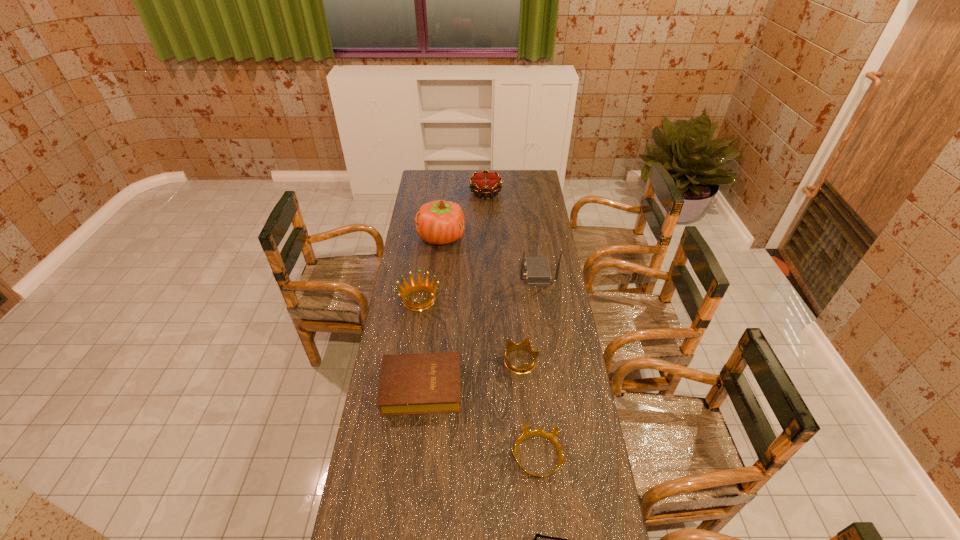
Image resolution: width=960 pixels, height=540 pixels. In order to click on the second farthest object in this screenshot , I will do `click(439, 222)`.

This screenshot has height=540, width=960. Find the location of `router`. router is located at coordinates (537, 273).

Locate an element on the screen. This screenshot has width=960, height=540. the farthest object is located at coordinates (485, 183).

Locate an element on the screen. The image size is (960, 540). the leftmost crown is located at coordinates (420, 286).

At what (x,y) coordinates should I click in order to perform the action: click on the third farthest crown. Please return your answer as a coordinate pair (x, y). This screenshot has width=960, height=540. Looking at the image, I should click on (525, 344).

You are a GUI agent. You are given a task and a screenshot of the screen. Output one action in this format:
    pyautogui.click(x=<x>, y=<y>)
    Task: Click on the Bible
    The height and width of the screenshot is (540, 960).
    Given the screenshot: What is the action you would take?
    pyautogui.click(x=422, y=383)

Locate an element on the screen. Image resolution: width=960 pixels, height=540 pixels. the second nearest object is located at coordinates (527, 433).

The width and height of the screenshot is (960, 540). Find the location of `the nearest crown`. the nearest crown is located at coordinates (527, 433).

Where is `free spot located on the side of the second farthest object with the cute face`? free spot located on the side of the second farthest object with the cute face is located at coordinates (532, 237).

This screenshot has width=960, height=540. I want to click on blank space located 0.260m on the back of the router to connect cables, so click(465, 273).